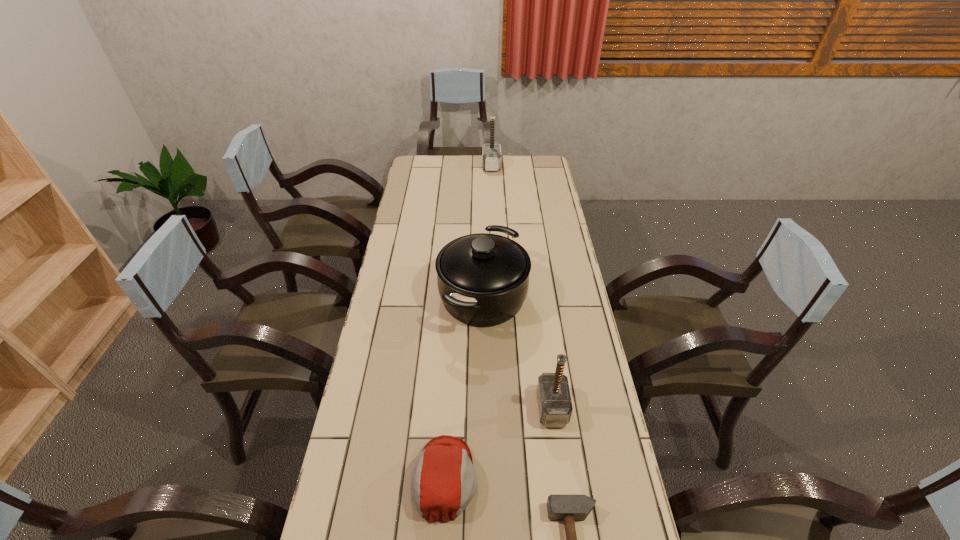
Where is `free space that is in between the cap and the saucepan`? This screenshot has width=960, height=540. free space that is in between the cap and the saucepan is located at coordinates (464, 387).

Locate an element on the screen. vacant space that is in between the fourth nearest object and the third farthest object is located at coordinates (517, 353).

Identify which object is the closest to the fourth nearest object. Please provide its 2D coordinates. Your answer should be formatted as a tuple, i.e. [(x, y)], where the tuple contains the x and y coordinates of a point satisfying the conditions above.

[(555, 408)]

Select which object appears as the closest to the nearest hammer. Please provide its 2D coordinates. Your answer should be formatted as a tuple, i.e. [(x, y)], where the tuple contains the x and y coordinates of a point satisfying the conditions above.

[(443, 482)]

Choose which hammer is the nearest neighbor to the shortest object. Please provide its 2D coordinates. Your answer should be formatted as a tuple, i.e. [(x, y)], where the tuple contains the x and y coordinates of a point satisfying the conditions above.

[(555, 408)]

You are a GUI agent. You are given a task and a screenshot of the screen. Output one action in this format:
    pyautogui.click(x=<x>, y=<y>)
    Task: Click on the second closest hammer relative to the leftmost hammer
    
    Given the screenshot: What is the action you would take?
    pyautogui.click(x=568, y=508)

This screenshot has width=960, height=540. In order to click on free space that satisfies the following two spatial constraints: 1. on the back side of the third farthest object; 2. for striking with the head of the farthest hammer in this screenshot , I will do `click(520, 166)`.

The height and width of the screenshot is (540, 960). What are the coordinates of `free region that satisfies the following two spatial constraints: 1. on the front side of the fourth nearest object; 2. on the front-facing side of the cap` in the screenshot? It's located at (484, 478).

Image resolution: width=960 pixels, height=540 pixels. I want to click on vacant space that satisfies the following two spatial constraints: 1. for striking with the head of the farthest object; 2. on the left side of the third farthest object, so click(501, 408).